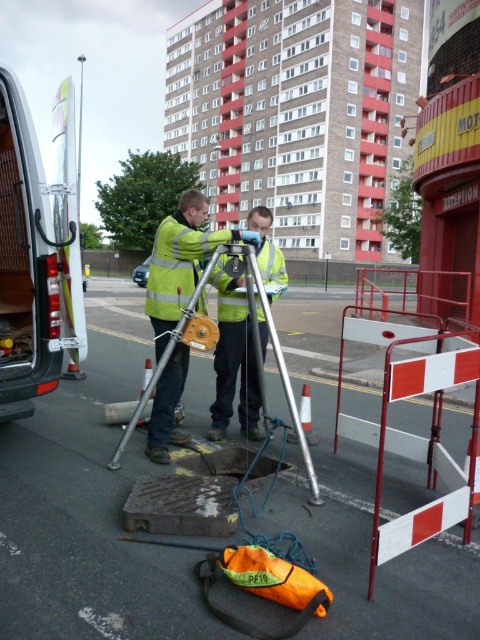
Does point (169, 221) come in front of point (252, 412)?

Yes, it is in front of point (252, 412).

Can you confirm if yellow reflective vest at center is taller than reflective yellow safety vest at center?

Correct, yellow reflective vest at center is much taller as reflective yellow safety vest at center.

Who is more distant from viewer, (184, 368) or (238, 342)?

Point (238, 342)

You are a GUI agent. You are given a task and a screenshot of the screen. Output one action in this format:
    pyautogui.click(x=<x>, y=<y>)
    Task: Click on the yellow reflective vest at center
    The width and height of the screenshot is (480, 640).
    Given the screenshot: What is the action you would take?
    pyautogui.click(x=180, y=262)

Describe the element at coordinates (180, 262) in the screenshot. I see `yellow reflective vest at center` at that location.

Does point (202, 301) come farther from viewer compared to point (139, 404)?

Yes, point (202, 301) is farther from viewer.

You are a GUI agent. You are given a task and a screenshot of the screen. Output one action in this format:
    pyautogui.click(x=<x>, y=<y>)
    Task: Click on the yellow reflective vest at center
    Image resolution: width=480 pixels, height=640 pixels.
    Given the screenshot: What is the action you would take?
    pyautogui.click(x=180, y=262)

Looking at this image, between reflective yellow safety vest at center and silver metallic tripod at center, which one has less height?

silver metallic tripod at center

Is point (257, 413) positioned after point (317, 496)?

Yes, it is.

I want to click on reflective yellow safety vest at center, so point(235,369).